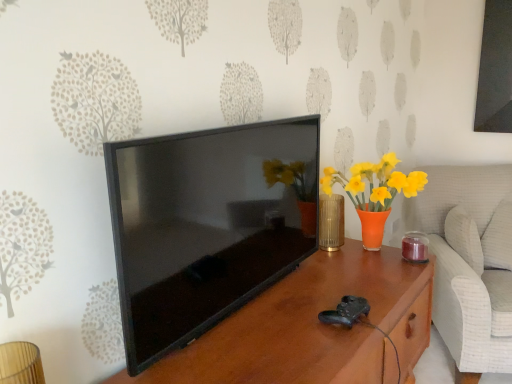
Locate an element on the screen. spots to the right of black glossy tv at center is located at coordinates (313, 295).